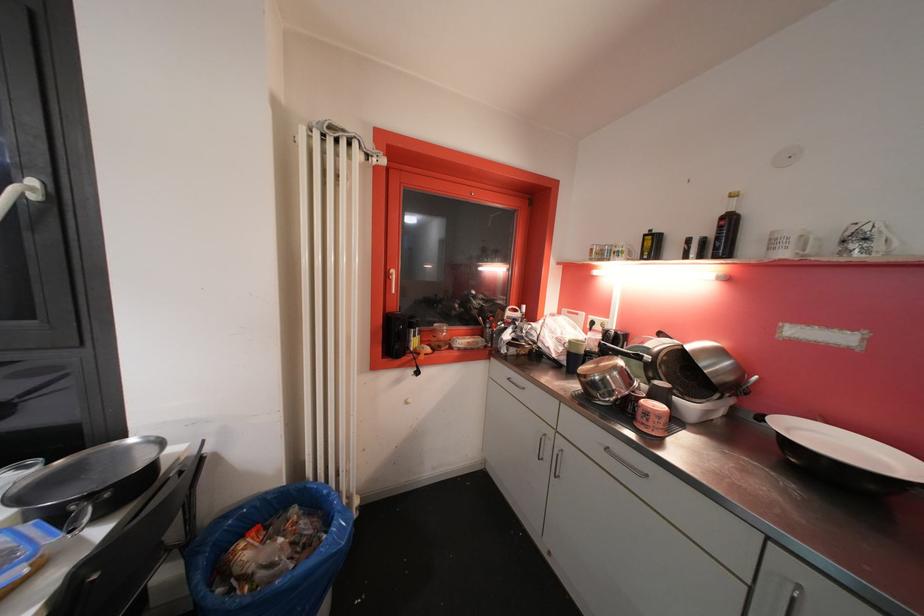
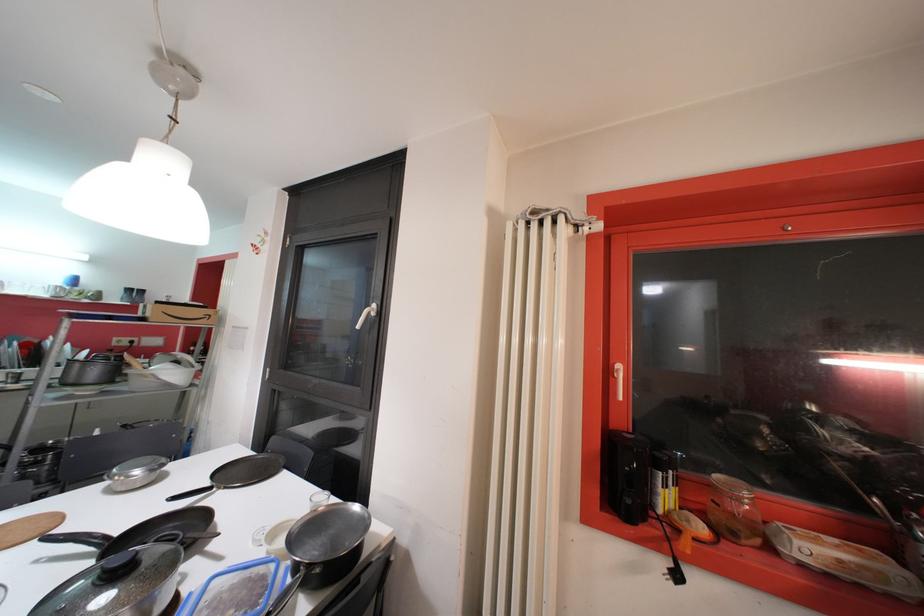
Question: The camera is either moving clockwise (left) or counter-clockwise (right) around the object. The first image is from the beginning of the video and the second image is from the end. Is the camera moving left or right when shooting the video?

Choices:
 (A) Left
 (B) Right

Answer: (B)